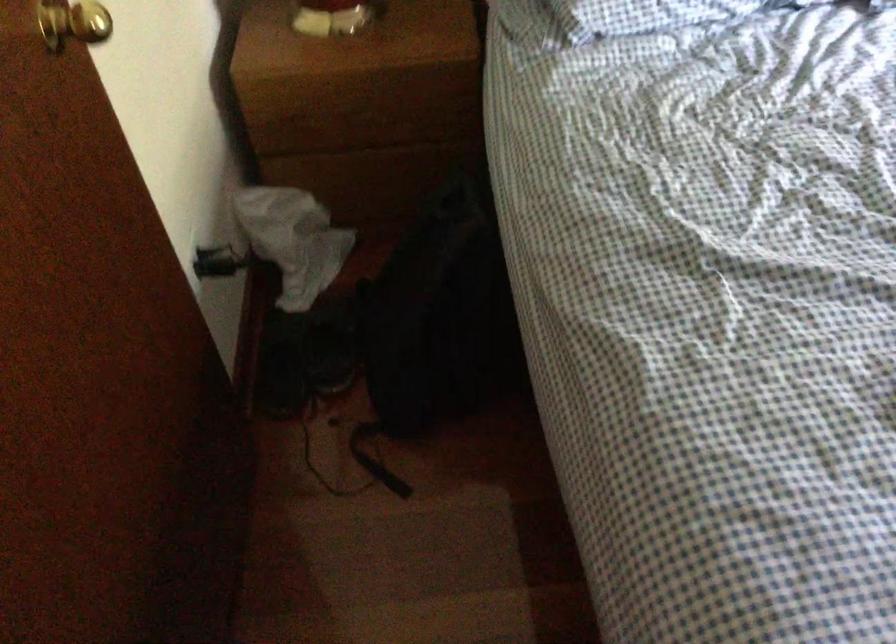
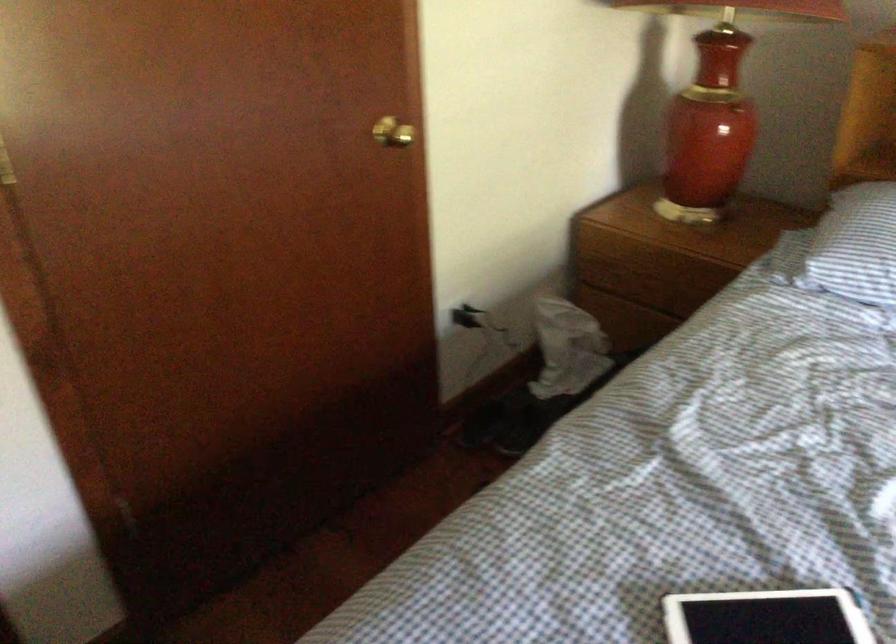
Question: I am providing you with two images of the same scene from different viewpoints. After the viewpoint changes to image2, which objects are now occluded?

Choices:
 (A) black backpack
 (B) gold doorknob
 (C) glass water bottle
 (D) black power plug

Answer: (A)